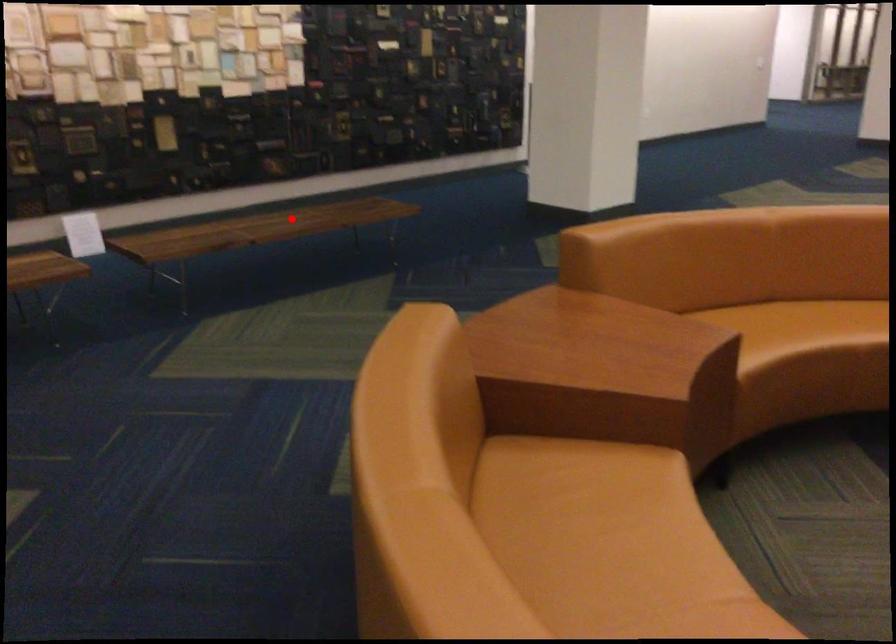
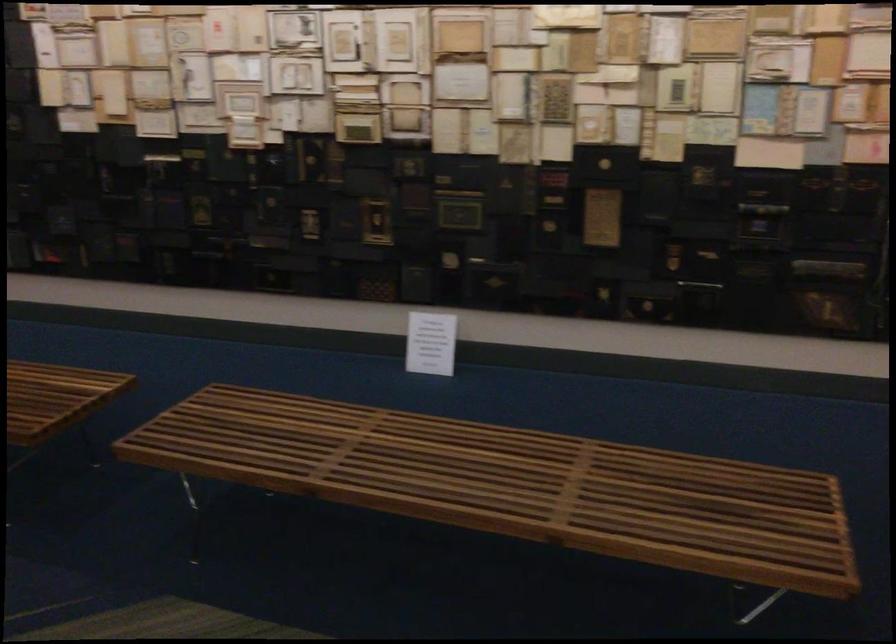
Question: I am providing you with two images of the same scene from different viewpoints. Image1 has a red point marked. In image2, the corresponding 3D location appears at what relative position? Reply with the corresponding letter.

Choices:
 (A) Closer
 (B) Farther

Answer: (A)